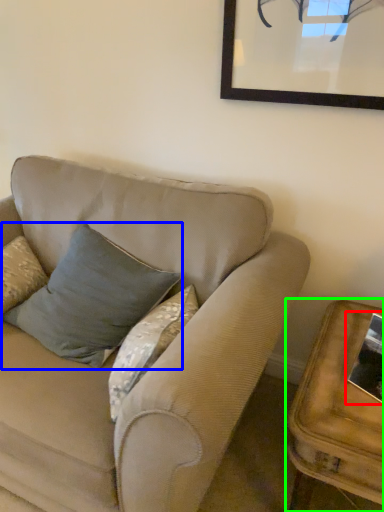
Question: Estimate the real-world distances between objects in this image. Which object is farther from picture frame (highlighted by a red box), pillow (highlighted by a blue box) or table (highlighted by a green box)?

Choices:
 (A) pillow
 (B) table

Answer: (A)